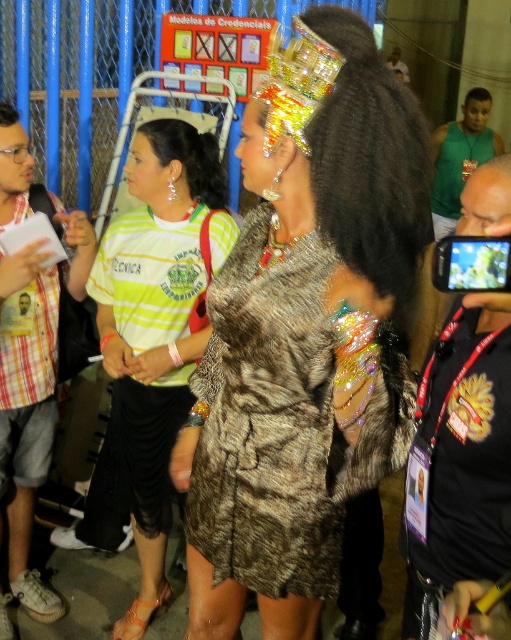
Question: Does green striped shirt at center appear on the left side of green fabric shirt at upper right?

Choices:
 (A) no
 (B) yes

Answer: (B)

Question: Is plaid cotton shirt at left to the right of green fabric shirt at upper right from the viewer's perspective?

Choices:
 (A) yes
 (B) no

Answer: (B)

Question: Does green striped shirt at center have a lesser width compared to green fabric shirt at upper right?

Choices:
 (A) yes
 (B) no

Answer: (B)

Question: Among these objects, which one is nearest to the camera?

Choices:
 (A) green fabric shirt at upper right
 (B) shiny black phone at right
 (C) fur coat at center

Answer: (B)

Question: Which point is farther to the camera?

Choices:
 (A) green fabric shirt at upper right
 (B) green striped shirt at center

Answer: (A)

Question: Among these points, which one is nearest to the camera?

Choices:
 (A) (150, 321)
 (B) (8, 337)

Answer: (A)